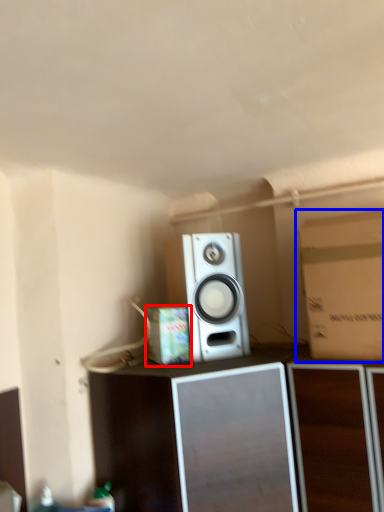
Question: Which object appears farthest to the camera in this image, cardboard box (highlighted by a red box) or cardboard box (highlighted by a blue box)?

Choices:
 (A) cardboard box
 (B) cardboard box

Answer: (A)